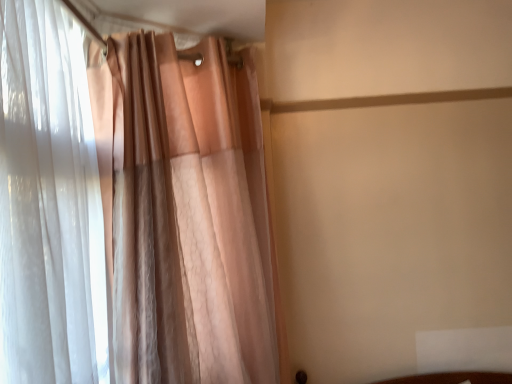
Question: Is translucent white curtain at left, which appears as the 1th curtain when viewed from the left, positioned with its back to translucent pink curtain at left, which is counted as the second curtain, starting from the left?

Choices:
 (A) yes
 (B) no

Answer: (B)

Question: From the image's perspective, is translucent white curtain at left, the second curtain positioned from the right, over translucent pink curtain at left, which is counted as the 1th curtain, starting from the right?

Choices:
 (A) yes
 (B) no

Answer: (A)

Question: Is translucent white curtain at left, the second curtain positioned from the right, at the right side of translucent pink curtain at left, which is counted as the 1th curtain, starting from the right?

Choices:
 (A) yes
 (B) no

Answer: (B)

Question: From a real-world perspective, is translucent white curtain at left, the second curtain positioned from the right, beneath translucent pink curtain at left, which is counted as the 1th curtain, starting from the right?

Choices:
 (A) no
 (B) yes

Answer: (A)

Question: Is there a large distance between translucent white curtain at left, the second curtain positioned from the right, and translucent pink curtain at left, which is counted as the 1th curtain, starting from the right?

Choices:
 (A) yes
 (B) no

Answer: (B)

Question: Is translucent white curtain at left, the second curtain positioned from the right, aimed at translucent pink curtain at left, which is counted as the 1th curtain, starting from the right?

Choices:
 (A) no
 (B) yes

Answer: (B)

Question: From a real-world perspective, is translucent pink curtain at left, which is counted as the second curtain, starting from the left, physically below translucent white curtain at left, which appears as the 1th curtain when viewed from the left?

Choices:
 (A) no
 (B) yes

Answer: (B)

Question: Can you confirm if translucent pink curtain at left, which is counted as the 1th curtain, starting from the right, is bigger than translucent white curtain at left, the second curtain positioned from the right?

Choices:
 (A) no
 (B) yes

Answer: (B)

Question: Does translucent pink curtain at left, which is counted as the second curtain, starting from the left, have a smaller size compared to translucent white curtain at left, which appears as the 1th curtain when viewed from the left?

Choices:
 (A) no
 (B) yes

Answer: (A)

Question: Can translucent white curtain at left, which appears as the 1th curtain when viewed from the left, be found inside translucent pink curtain at left, which is counted as the second curtain, starting from the left?

Choices:
 (A) yes
 (B) no

Answer: (A)

Question: Is translucent pink curtain at left, which is counted as the second curtain, starting from the left, thinner than translucent white curtain at left, the second curtain positioned from the right?

Choices:
 (A) no
 (B) yes

Answer: (A)

Question: From the image's perspective, would you say translucent pink curtain at left, which is counted as the second curtain, starting from the left, is shown under translucent white curtain at left, which appears as the 1th curtain when viewed from the left?

Choices:
 (A) yes
 (B) no

Answer: (A)

Question: Based on their sizes in the image, would you say translucent white curtain at left, which appears as the 1th curtain when viewed from the left, is bigger or smaller than translucent pink curtain at left, which is counted as the second curtain, starting from the left?

Choices:
 (A) big
 (B) small

Answer: (B)